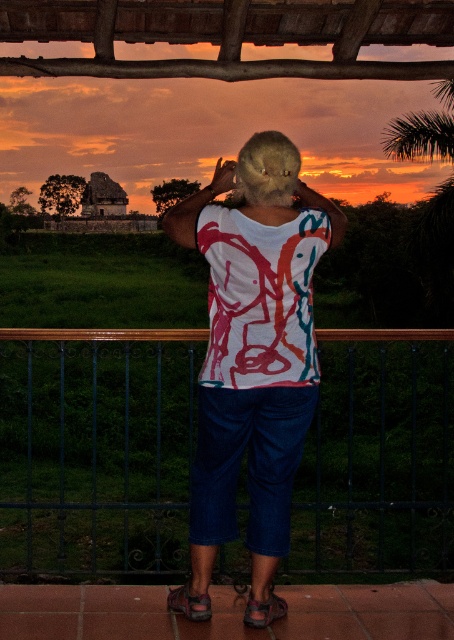
Which is behind, point (437, 346) or point (312, 212)?

The point (437, 346) is behind.

Is metallic blue fence at lower center bigger than white printed shirt at center?

Indeed, metallic blue fence at lower center has a larger size compared to white printed shirt at center.

Who is more forward, (177, 412) or (256, 557)?

Point (256, 557)

Where is `metallic blue fence at lower center`? The image size is (454, 640). metallic blue fence at lower center is located at coordinates (97, 449).

Who is more distant from viewer, [296,572] or [236,173]?

The point [296,572] is behind.

Find the location of `metallic blue fence at lower center`. metallic blue fence at lower center is located at coordinates (97, 449).

This screenshot has width=454, height=640. In order to click on metallic blue fence at lower center in this screenshot , I will do `click(97, 449)`.

Who is positioned more to the left, white printed shirt at center or fuzzy brown head at center?

white printed shirt at center

Who is positioned more to the right, white printed shirt at center or fuzzy brown head at center?

Positioned to the right is fuzzy brown head at center.

What do you see at coordinates (252, 358) in the screenshot? I see `white printed shirt at center` at bounding box center [252, 358].

Identify the location of white printed shirt at center. The image size is (454, 640). (252, 358).